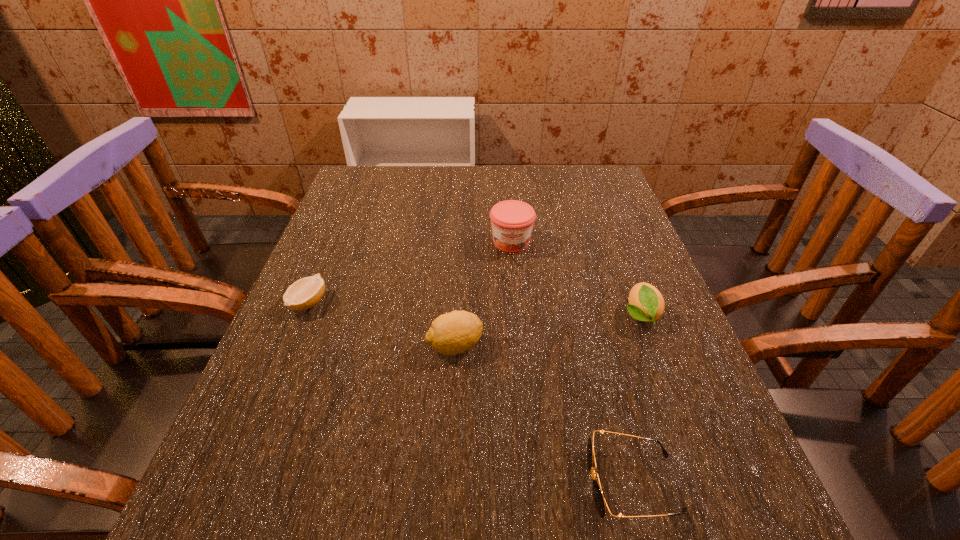
Where is `free space located with leaves positioned above the rightmost lemon`? The width and height of the screenshot is (960, 540). free space located with leaves positioned above the rightmost lemon is located at coordinates (694, 458).

Locate an element on the screen. The width and height of the screenshot is (960, 540). vacant space located 0.280m on the right of the leftmost object is located at coordinates (458, 302).

The width and height of the screenshot is (960, 540). I want to click on free spot located 0.340m on the front-facing side of the fourth object from left to right, so click(x=360, y=483).

Image resolution: width=960 pixels, height=540 pixels. What are the coordinates of `vacant space located 0.180m on the front-facing side of the fourth object from left to right` in the screenshot? It's located at (468, 483).

Locate an element on the screen. This screenshot has width=960, height=540. vacant space situated on the front-facing side of the fourth object from left to right is located at coordinates (528, 483).

Locate an element on the screen. The height and width of the screenshot is (540, 960). object present at the near edge is located at coordinates (599, 499).

The image size is (960, 540). In order to click on object that is at the left edge in this screenshot , I will do click(305, 293).

Identify the location of lemon at the right edge. The height and width of the screenshot is (540, 960). (646, 303).

This screenshot has width=960, height=540. What are the coordinates of `sunglasses that is at the right edge` in the screenshot? It's located at (599, 499).

At what (x,y) coordinates should I click in order to perform the action: click on object at the near right corner. Please return your answer as a coordinate pair (x, y). Looking at the image, I should click on (599, 499).